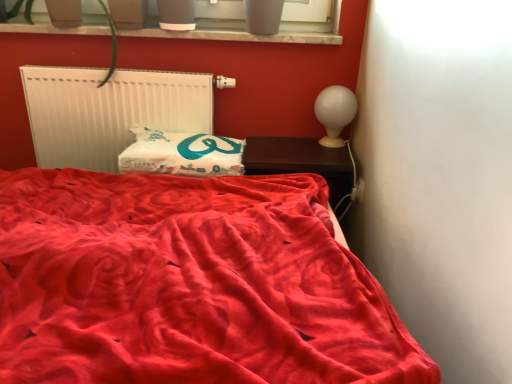
At what (x,y) coordinates should I click in order to perform the action: click on free spot in front of white glossy table lamp at upper right. Please return your answer as a coordinate pair (x, y). The width and height of the screenshot is (512, 384). Looking at the image, I should click on (327, 160).